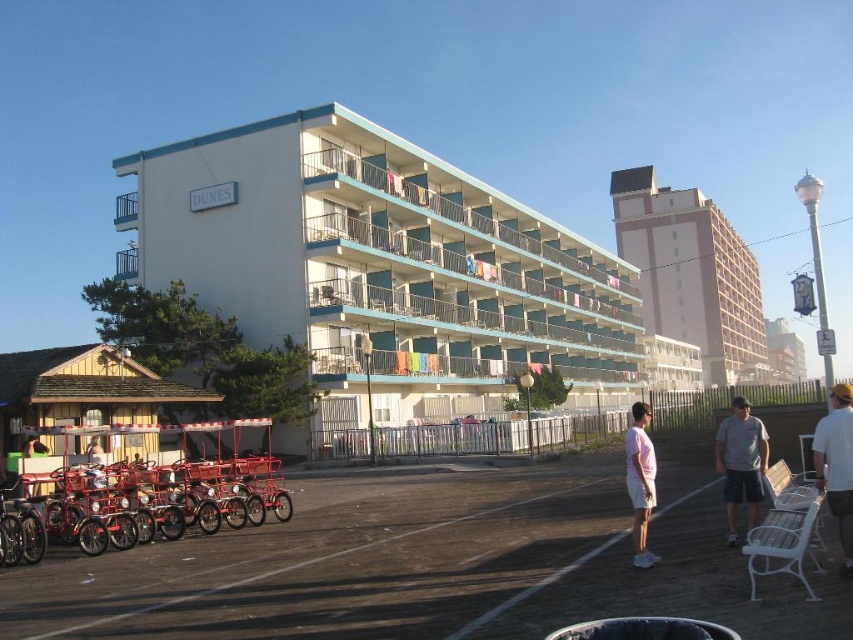
Question: Which object appears closest to the camera in this image?

Choices:
 (A) wooden building at lower left
 (B) tan fabric shirt at center

Answer: (A)

Question: Does gray cotton shirt at center have a smaller size compared to tan fabric shirt at center?

Choices:
 (A) yes
 (B) no

Answer: (B)

Question: Which point appears closest to the camera in this image?

Choices:
 (A) (27, 442)
 (B) (99, 452)

Answer: (A)

Question: Is white fabric shirt at lower right to the left of pink matte shirt at center from the viewer's perspective?

Choices:
 (A) no
 (B) yes

Answer: (A)

Question: Which is farther from the tan fabric shirt at center?

Choices:
 (A) white fabric shirt at lower right
 (B) pink matte shirt at center

Answer: (A)

Question: Does white matte building at center have a larger size compared to metallic red tricycles at lower left?

Choices:
 (A) yes
 (B) no

Answer: (A)